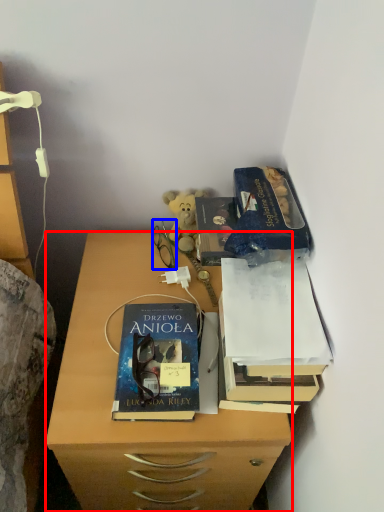
Question: Which of the following is the farthest to the observer, desk (highlighted by a red box) or glasses (highlighted by a blue box)?

Choices:
 (A) desk
 (B) glasses

Answer: (B)